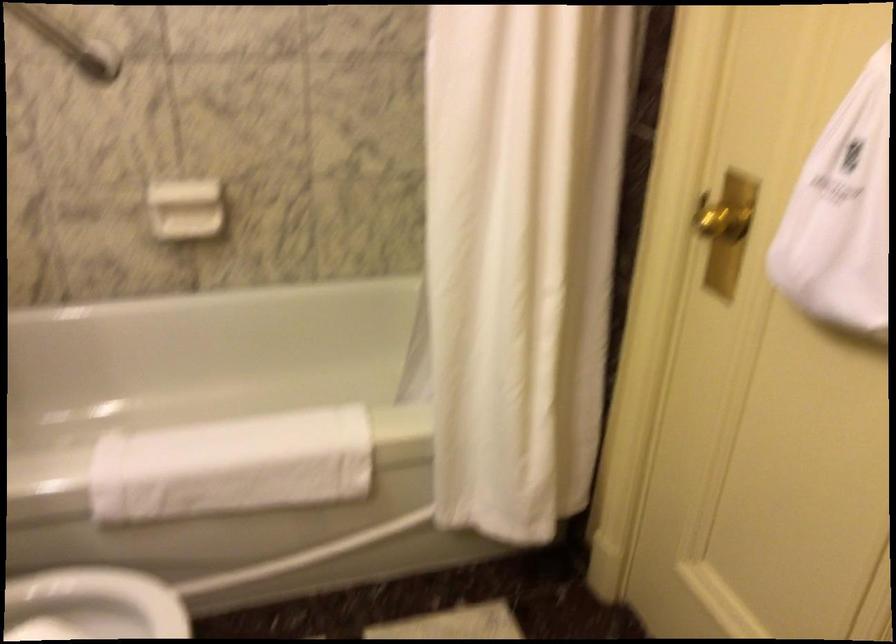
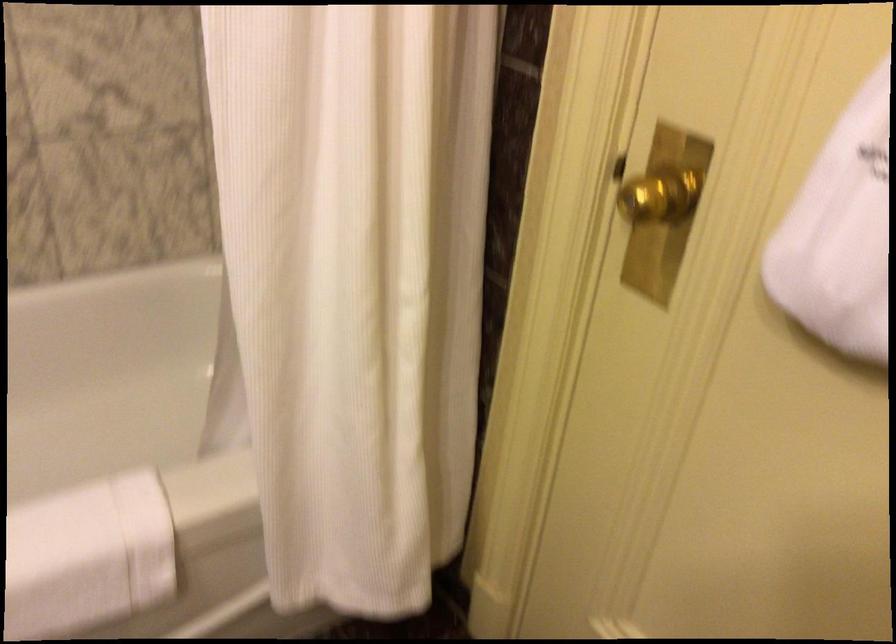
The point at (724, 207) is marked in the first image. Where is the corresponding point in the second image?

(657, 194)